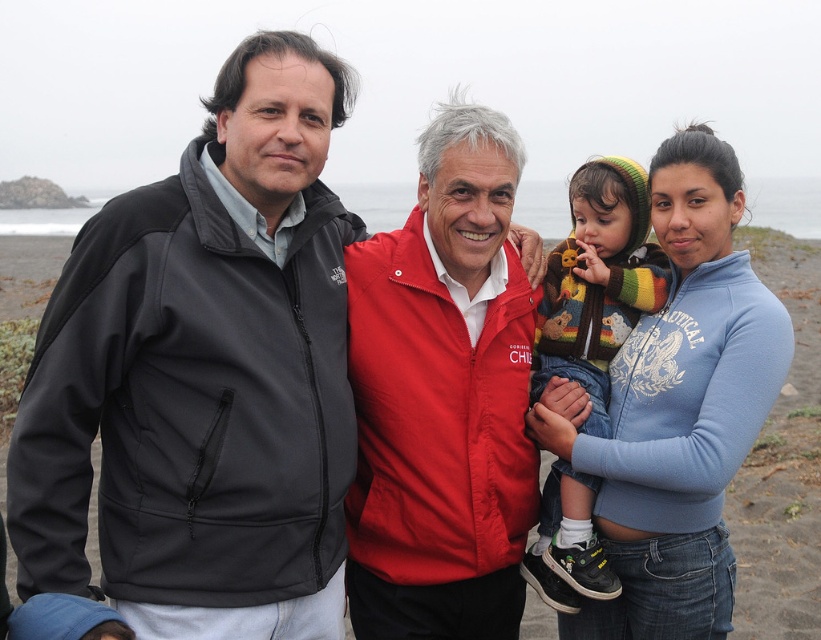
Question: Which object appears closest to the camera in this image?

Choices:
 (A) red matte jacket at center
 (B) matte black jacket at left

Answer: (B)

Question: Which point is closer to the camera?

Choices:
 (A) knitted wool sweater at center
 (B) blue fleece jacket at center
 (C) matte black jacket at left

Answer: (C)

Question: Is matte black jacket at left in front of red matte jacket at center?

Choices:
 (A) yes
 (B) no

Answer: (A)

Question: Does matte black jacket at left have a smaller size compared to red matte jacket at center?

Choices:
 (A) yes
 (B) no

Answer: (B)

Question: Is matte black jacket at left to the right of knitted wool sweater at center from the viewer's perspective?

Choices:
 (A) no
 (B) yes

Answer: (A)

Question: Which of the following is the farthest from the observer?

Choices:
 (A) red matte jacket at center
 (B) knitted wool sweater at center
 (C) blue fleece jacket at center

Answer: (B)